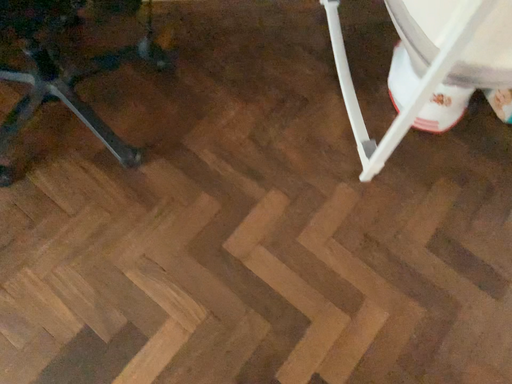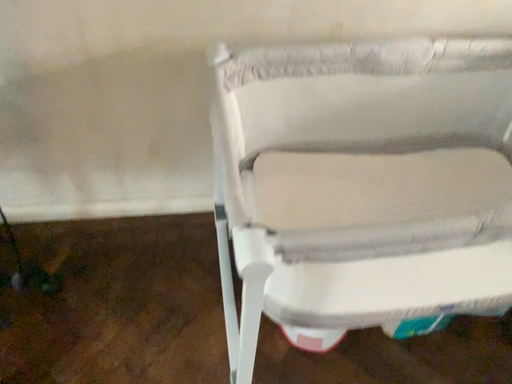
Question: Which way did the camera rotate in the video?

Choices:
 (A) rotated downward
 (B) rotated upward

Answer: (B)